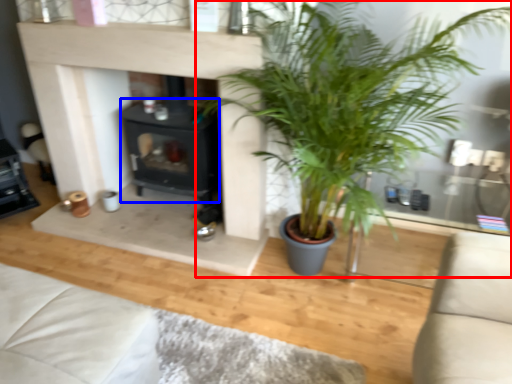
Question: Which object appears farthest to the camera in this image, houseplant (highlighted by a red box) or fireplace (highlighted by a blue box)?

Choices:
 (A) houseplant
 (B) fireplace

Answer: (B)